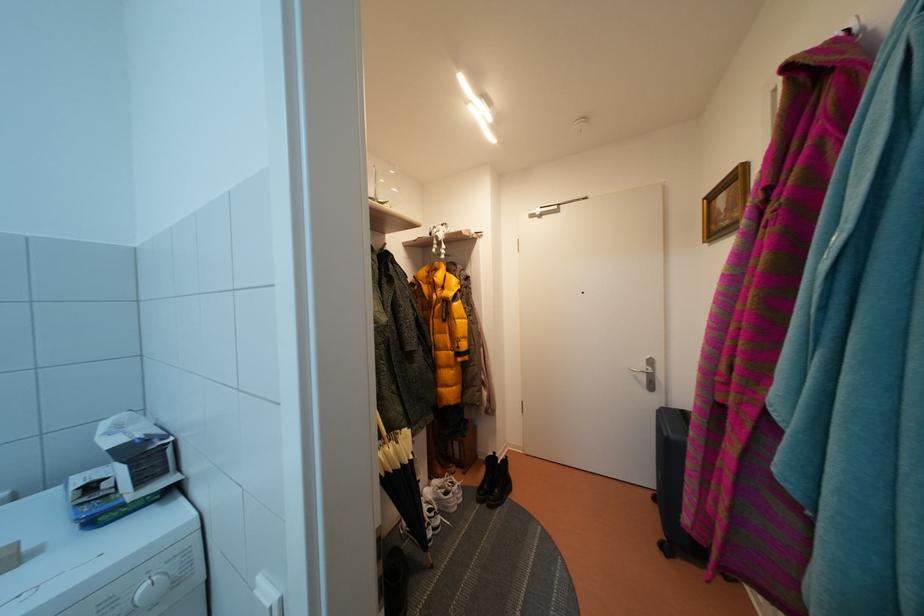
Where is `curved umbrella handle`? The width and height of the screenshot is (924, 616). curved umbrella handle is located at coordinates (402, 483).